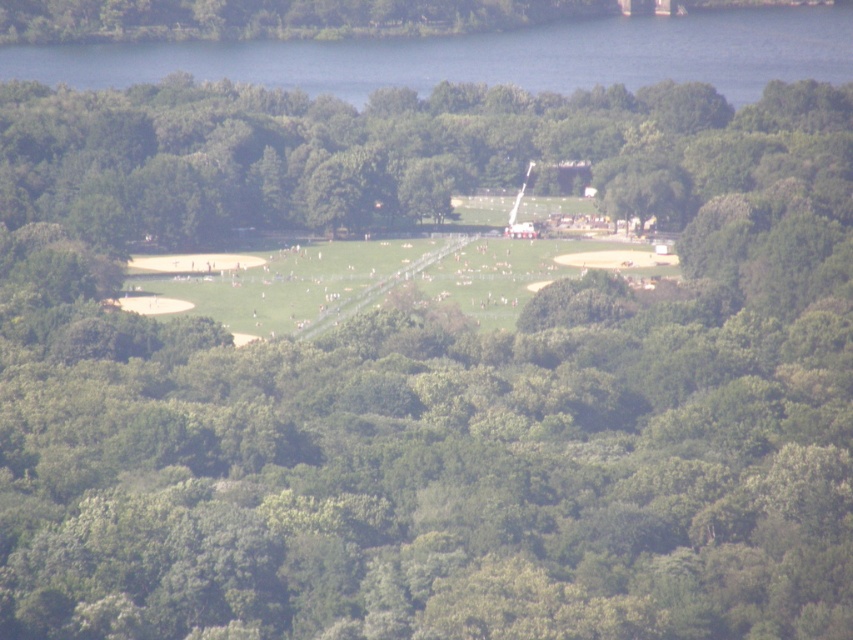
You are planning to set up a picnic blanket in the park. The blue water at upper center and the green grassy field at center are both potential spots. Which area is wider and thus can accommodate a larger blanket?

The blue water at upper center is wider than the green grassy field at center, so it can accommodate a larger blanket.

You are a photographer trying to capture a shot of the blue water at upper center and the green grassy field at center. From your current position, which object is higher in the frame?

The blue water at upper center is higher in the frame than the green grassy field at center because it is positioned above it.